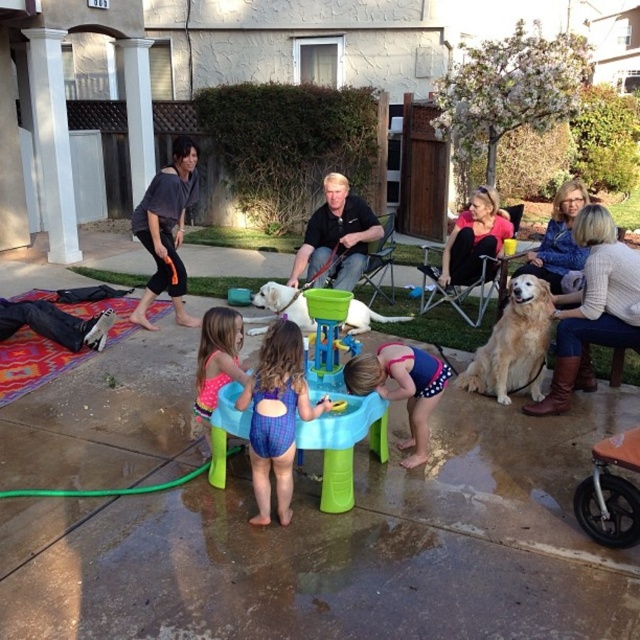
Question: Does golden fur dog at right have a larger size compared to black matte shirt at center?

Choices:
 (A) no
 (B) yes

Answer: (A)

Question: Is blue swimsuit at center in front of pink polka dot swimsuit at center?

Choices:
 (A) yes
 (B) no

Answer: (B)

Question: Can you confirm if blue swimsuit at center is positioned above pink polka dot swimsuit at center?

Choices:
 (A) no
 (B) yes

Answer: (A)

Question: Which point appears farthest from the camera in this image?

Choices:
 (A) (362, 224)
 (B) (420, 348)

Answer: (A)

Question: Among these points, which one is farthest from the camera?

Choices:
 (A) (188, 168)
 (B) (228, 378)

Answer: (A)

Question: Based on their relative distances, which object is farther from the black matte shirt at center?

Choices:
 (A) blue plaid swimsuit at center
 (B) blue swimsuit at center
 (C) pink polka dot swimsuit at center

Answer: (A)